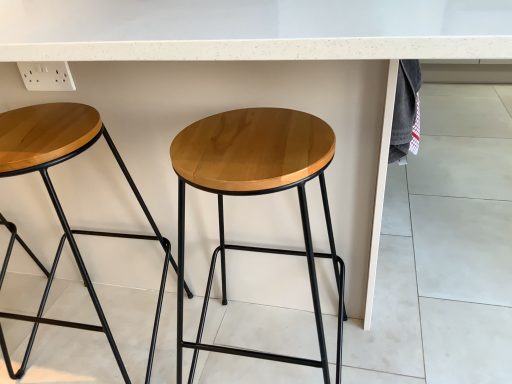
Identify the location of free space between wooden seat stool at center, marked as the second stool in a right-to-left arrangement, and natural wood stool at center, which is the first stool from right to left. The height and width of the screenshot is (384, 512). click(194, 336).